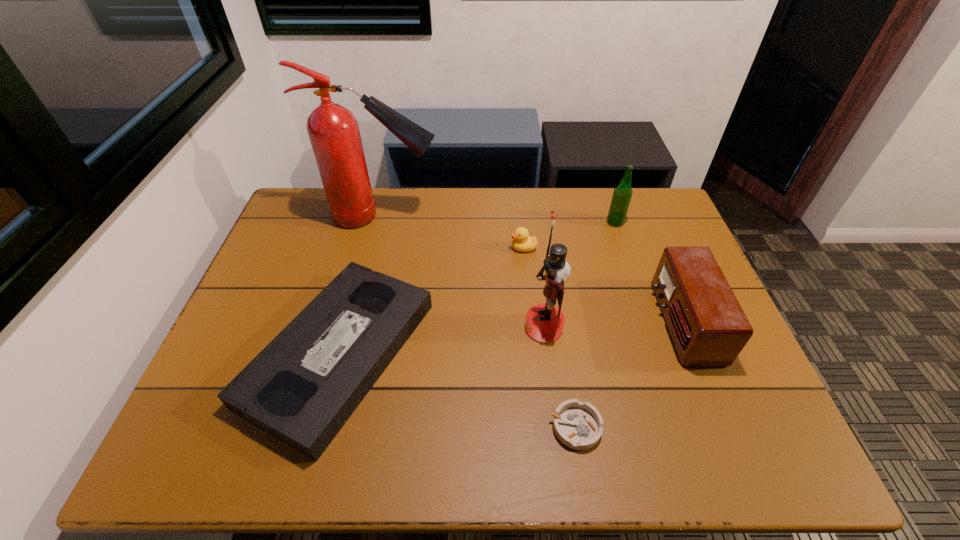
Locate an element on the screen. The height and width of the screenshot is (540, 960). blank space located on the front-facing side of the nutcracker is located at coordinates (374, 327).

Where is `free space located on the front-facing side of the nutcracker`? Image resolution: width=960 pixels, height=540 pixels. free space located on the front-facing side of the nutcracker is located at coordinates (390, 327).

Locate an element on the screen. This screenshot has width=960, height=540. free region located 0.050m on the label of the fifth shortest object is located at coordinates (591, 222).

Locate an element on the screen. This screenshot has width=960, height=540. vacant space located 0.380m on the label of the fifth shortest object is located at coordinates (492, 222).

What are the coordinates of `vacant space located on the label of the fifth shortest object` in the screenshot? It's located at (591, 222).

Identify the location of free space located 0.140m on the front-facing side of the fourth tallest object. (607, 322).

Identify the location of free spot located 0.320m on the front-facing side of the fourth tallest object. (540, 322).

Where is `vacant area situated 0.360m on the front-facing side of the fourth tallest object`? This screenshot has height=540, width=960. vacant area situated 0.360m on the front-facing side of the fourth tallest object is located at coordinates (525, 322).

Locate an element on the screen. This screenshot has width=960, height=540. free space located on the face of the duckling is located at coordinates (450, 248).

At what (x,y) coordinates should I click in order to perform the action: click on vacant region located 0.290m on the face of the duckling. Please return your answer as a coordinate pair (x, y). Looking at the image, I should click on (418, 248).